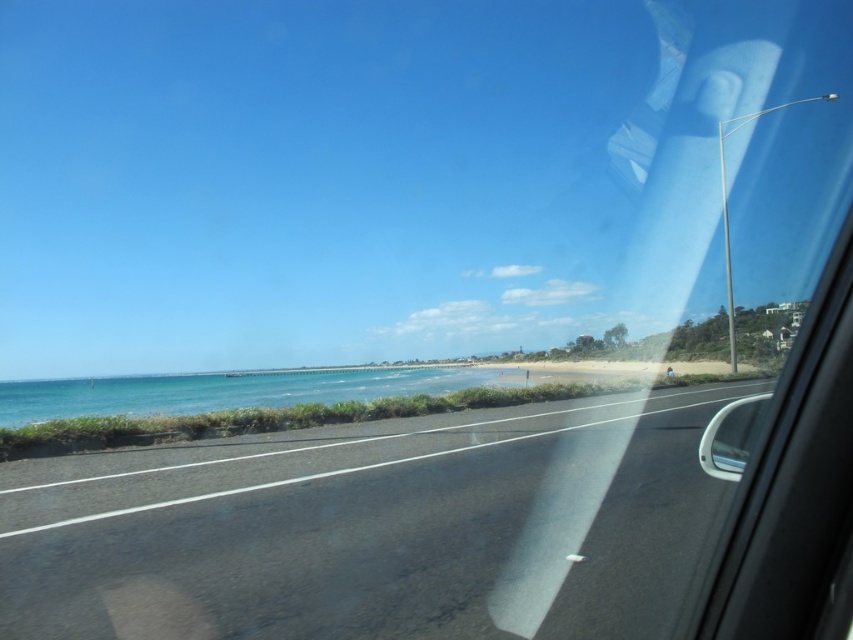
You are driving along the coastal road and notice the black asphalt highway at center and the blue water at lower left through your car window. Which object is positioned to the right of the other?

The black asphalt highway at center is to the right of blue water at lower left.

You are driving along a coastal road and notice a point on your GPS at coordinates (373, 531). According to the scene, what type of surface does this point indicate?

The point at coordinates (373, 531) corresponds to the black asphalt highway at center, indicating it is on the road surface.

You are driving along the coastal road and notice the black asphalt highway at center and the blue water at lower left through your car window. Which of these two objects appears larger in the scene?

The blue water at lower left appears larger than the black asphalt highway at center in the scene.